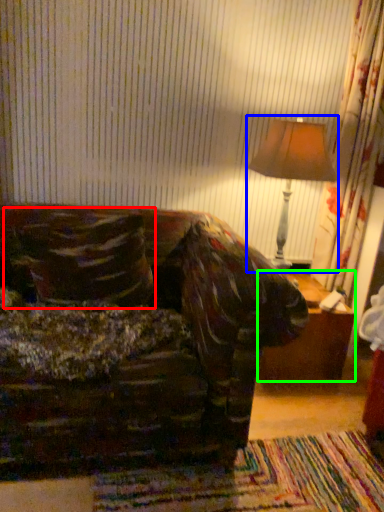
Question: Based on their relative distances, which object is nearer to throw pillow (highlighted by a red box)? Choose from table lamp (highlighted by a blue box) and table (highlighted by a green box).

Choices:
 (A) table lamp
 (B) table

Answer: (A)